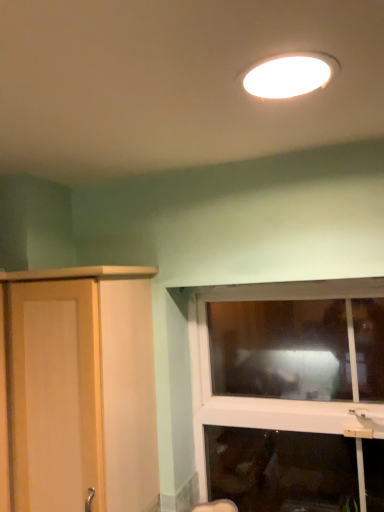
Question: Is transparent glass window at lower right at the back of light wood cupboard at left?

Choices:
 (A) yes
 (B) no

Answer: (B)

Question: Is transparent glass window at lower right surrounded by light wood cupboard at left?

Choices:
 (A) yes
 (B) no

Answer: (B)

Question: Can you confirm if light wood cupboard at left is taller than transparent glass window at lower right?

Choices:
 (A) yes
 (B) no

Answer: (A)

Question: Considering the relative sizes of light wood cupboard at left and transparent glass window at lower right in the image provided, is light wood cupboard at left wider than transparent glass window at lower right?

Choices:
 (A) yes
 (B) no

Answer: (A)

Question: Does light wood cupboard at left have a lesser height compared to transparent glass window at lower right?

Choices:
 (A) yes
 (B) no

Answer: (B)

Question: Is light wood cupboard at left inside the boundaries of white glossy light fixture at upper center, or outside?

Choices:
 (A) outside
 (B) inside

Answer: (A)

Question: Considering their positions, is light wood cupboard at left located in front of or behind white glossy light fixture at upper center?

Choices:
 (A) front
 (B) behind

Answer: (B)

Question: From the image's perspective, relative to white glossy light fixture at upper center, is light wood cupboard at left above or below?

Choices:
 (A) below
 (B) above

Answer: (A)

Question: In terms of height, does light wood cupboard at left look taller or shorter compared to white glossy light fixture at upper center?

Choices:
 (A) short
 (B) tall

Answer: (B)

Question: Is point (279, 96) positioned closer to the camera than point (317, 508)?

Choices:
 (A) closer
 (B) farther

Answer: (A)

Question: Based on their positions, is white glossy light fixture at upper center located to the left or right of transparent glass window at lower right?

Choices:
 (A) left
 (B) right

Answer: (A)

Question: From a real-world perspective, is white glossy light fixture at upper center positioned above or below transparent glass window at lower right?

Choices:
 (A) below
 (B) above

Answer: (B)

Question: Is white glossy light fixture at upper center in front of or behind transparent glass window at lower right in the image?

Choices:
 (A) front
 (B) behind

Answer: (A)

Question: Is light wood cupboard at left taller or shorter than transparent glass window at lower right?

Choices:
 (A) tall
 (B) short

Answer: (A)

Question: From a real-world perspective, is light wood cupboard at left physically located above or below transparent glass window at lower right?

Choices:
 (A) below
 (B) above

Answer: (B)